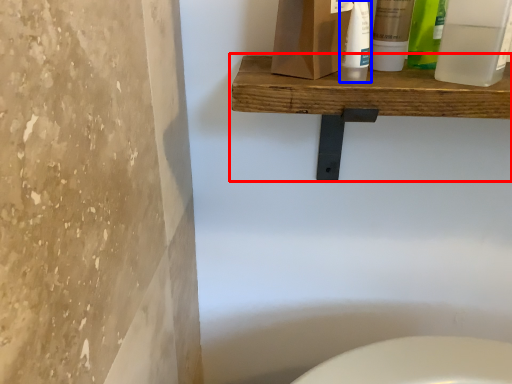
Question: Which object appears closest to the camera in this image, shelf (highlighted by a red box) or cleaning product (highlighted by a blue box)?

Choices:
 (A) shelf
 (B) cleaning product

Answer: (A)